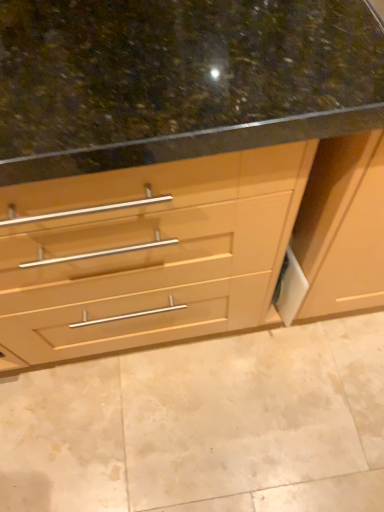
Question: Is brown polished granite at center bigger than matte wood cabinet at center?

Choices:
 (A) no
 (B) yes

Answer: (A)

Question: Considering the relative sizes of brown polished granite at center and matte wood cabinet at center in the image provided, is brown polished granite at center shorter than matte wood cabinet at center?

Choices:
 (A) no
 (B) yes

Answer: (B)

Question: Are brown polished granite at center and matte wood cabinet at center beside each other?

Choices:
 (A) no
 (B) yes

Answer: (A)

Question: Is the position of brown polished granite at center less distant than that of matte wood cabinet at center?

Choices:
 (A) yes
 (B) no

Answer: (B)

Question: Does brown polished granite at center contain matte wood cabinet at center?

Choices:
 (A) no
 (B) yes

Answer: (A)

Question: Is brown polished granite at center to the right of matte wood cabinet at center from the viewer's perspective?

Choices:
 (A) no
 (B) yes

Answer: (A)

Question: Is matte wood cabinet at center smaller than brown polished granite at center?

Choices:
 (A) no
 (B) yes

Answer: (A)

Question: Considering the relative positions of matte wood cabinet at center and brown polished granite at center in the image provided, is matte wood cabinet at center in front of brown polished granite at center?

Choices:
 (A) yes
 (B) no

Answer: (A)

Question: Is matte wood cabinet at center aimed at brown polished granite at center?

Choices:
 (A) no
 (B) yes

Answer: (B)

Question: Can you confirm if matte wood cabinet at center is bigger than brown polished granite at center?

Choices:
 (A) yes
 (B) no

Answer: (A)

Question: Can you confirm if matte wood cabinet at center is positioned to the left of brown polished granite at center?

Choices:
 (A) yes
 (B) no

Answer: (B)

Question: Is matte wood cabinet at center positioned beyond the bounds of brown polished granite at center?

Choices:
 (A) no
 (B) yes

Answer: (B)

Question: In the image, is brown polished granite at center on the left side or the right side of matte wood cabinet at center?

Choices:
 (A) left
 (B) right

Answer: (A)